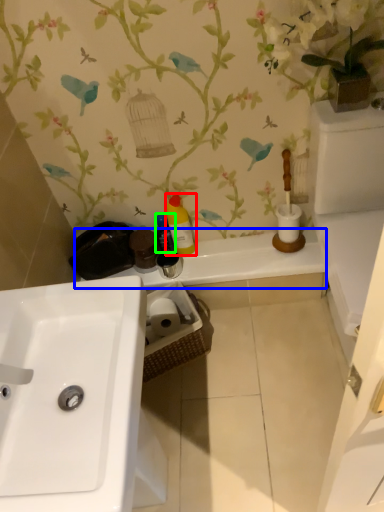
Question: Estimate the real-world distances between objects in this image. Which object is farther from cleaning product (highlighted by a red box), counter top (highlighted by a blue box) or cleaning product (highlighted by a green box)?

Choices:
 (A) counter top
 (B) cleaning product

Answer: (A)